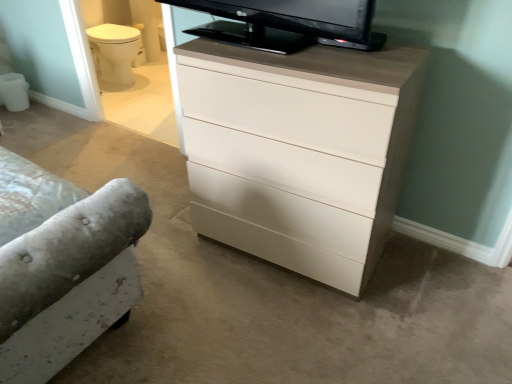
Question: Is white matte drawer at center facing away from white glossy chest of drawers at center?

Choices:
 (A) no
 (B) yes

Answer: (A)

Question: From a real-world perspective, is white matte drawer at center positioned under white glossy chest of drawers at center based on gravity?

Choices:
 (A) no
 (B) yes

Answer: (B)

Question: Are white matte drawer at center and white glossy chest of drawers at center beside each other?

Choices:
 (A) yes
 (B) no

Answer: (B)

Question: Is white matte drawer at center oriented towards white glossy chest of drawers at center?

Choices:
 (A) yes
 (B) no

Answer: (A)

Question: Is white matte drawer at center at the left side of white glossy chest of drawers at center?

Choices:
 (A) yes
 (B) no

Answer: (B)

Question: From the image's perspective, is white matte drawer at center below white glossy chest of drawers at center?

Choices:
 (A) yes
 (B) no

Answer: (A)

Question: Can you see white glossy chest of drawers at center touching white matte drawer at center?

Choices:
 (A) yes
 (B) no

Answer: (B)

Question: Considering the relative sizes of white glossy chest of drawers at center and white matte drawer at center in the image provided, is white glossy chest of drawers at center thinner than white matte drawer at center?

Choices:
 (A) no
 (B) yes

Answer: (A)

Question: Is white glossy chest of drawers at center not close to white matte drawer at center?

Choices:
 (A) yes
 (B) no

Answer: (B)

Question: Is white matte drawer at center at the back of white glossy chest of drawers at center?

Choices:
 (A) yes
 (B) no

Answer: (A)

Question: Can you confirm if white glossy chest of drawers at center is smaller than white matte drawer at center?

Choices:
 (A) yes
 (B) no

Answer: (B)

Question: Can you confirm if white glossy chest of drawers at center is bigger than white matte drawer at center?

Choices:
 (A) yes
 (B) no

Answer: (A)

Question: From the image's perspective, is white matte drawer at center located above or below white glossy chest of drawers at center?

Choices:
 (A) below
 (B) above

Answer: (A)